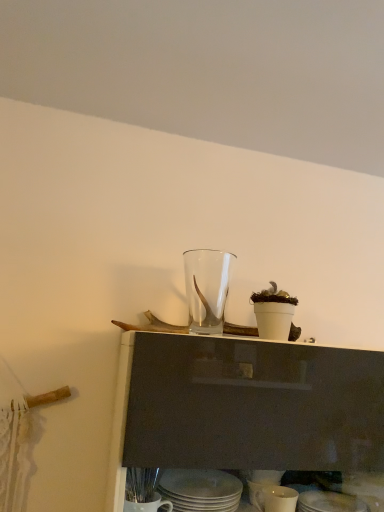
Describe the element at coordinates (200, 490) in the screenshot. I see `white ceramic plates at lower center, which appears as the second tableware when viewed from the top` at that location.

Measure the distance between point (x=189, y=483) and camera.

They are 3.41 feet apart.

I want to click on matte white plate at lower center, which ranks as the fourth tableware in top-to-bottom order, so tap(329, 502).

Which of these two, transparent glass vase at center, arranged as the 1th tableware when viewed from the top, or matte white plate at lower center, which ranks as the fourth tableware in top-to-bottom order, is thinner?

matte white plate at lower center, which ranks as the fourth tableware in top-to-bottom order, is thinner.

How distant is transparent glass vase at center, arranged as the 1th tableware when viewed from the top, from matte white plate at lower center, which appears as the first tableware when ordered from the bottom?

They are 22.08 inches apart.

Which of these two, transparent glass vase at center, which is the fourth tableware in bottom-to-top order, or matte white plate at lower center, which ranks as the fourth tableware in top-to-bottom order, is smaller?

matte white plate at lower center, which ranks as the fourth tableware in top-to-bottom order.

Is the depth of transparent glass vase at center, arranged as the 1th tableware when viewed from the top, less than that of matte white plate at lower center, which appears as the first tableware when ordered from the bottom?

No.

Is white ceramic plates at lower center, which appears as the second tableware when viewed from the top, in front of white glossy mug at lower center, arranged as the 3th tableware when viewed from the top?

Yes, it is in front of white glossy mug at lower center, arranged as the 3th tableware when viewed from the top.

Is white ceramic plates at lower center, arranged as the third tableware when ordered from the bottom, aimed at white glossy mug at lower center, acting as the 2th tableware starting from the bottom?

No, white ceramic plates at lower center, arranged as the third tableware when ordered from the bottom, is not oriented towards white glossy mug at lower center, acting as the 2th tableware starting from the bottom.

Which of these two, white ceramic plates at lower center, arranged as the third tableware when ordered from the bottom, or white glossy mug at lower center, arranged as the 3th tableware when viewed from the top, is bigger?

white ceramic plates at lower center, arranged as the third tableware when ordered from the bottom.

Is white glossy mug at lower center, arranged as the 3th tableware when viewed from the top, smaller than transparent glass vase at center, which is the fourth tableware in bottom-to-top order?

Yes, white glossy mug at lower center, arranged as the 3th tableware when viewed from the top, is smaller than transparent glass vase at center, which is the fourth tableware in bottom-to-top order.

Which is behind, point (270, 497) or point (187, 290)?

Positioned behind is point (187, 290).

From the image's perspective, which is below, white glossy mug at lower center, acting as the 2th tableware starting from the bottom, or transparent glass vase at center, which is the fourth tableware in bottom-to-top order?

white glossy mug at lower center, acting as the 2th tableware starting from the bottom, is shown below in the image.

Is the depth of white glossy mug at lower center, acting as the 2th tableware starting from the bottom, greater than that of transparent glass vase at center, which is the fourth tableware in bottom-to-top order?

No, it is not.

Is matte white plate at lower center, which appears as the first tableware when ordered from the bottom, facing towards white glossy mug at lower center, arranged as the 3th tableware when viewed from the top?

A: No, matte white plate at lower center, which appears as the first tableware when ordered from the bottom, is not aimed at white glossy mug at lower center, arranged as the 3th tableware when viewed from the top.

In the scene shown: Can you confirm if matte white plate at lower center, which ranks as the fourth tableware in top-to-bottom order, is positioned to the right of white glossy mug at lower center, acting as the 2th tableware starting from the bottom?

Correct, you'll find matte white plate at lower center, which ranks as the fourth tableware in top-to-bottom order, to the right of white glossy mug at lower center, acting as the 2th tableware starting from the bottom.

The width and height of the screenshot is (384, 512). I want to click on tableware below the white glossy mug at lower center, acting as the 2th tableware starting from the bottom (from the image's perspective), so click(x=329, y=502).

In the scene shown: Between matte white plate at lower center, which appears as the first tableware when ordered from the bottom, and white glossy mug at lower center, arranged as the 3th tableware when viewed from the top, which one has more height?

white glossy mug at lower center, arranged as the 3th tableware when viewed from the top.

Is point (287, 488) closer or farther from the camera than point (344, 504)?

Point (287, 488) is positioned closer to the camera compared to point (344, 504).

Can you confirm if white glossy mug at lower center, acting as the 2th tableware starting from the bottom, is thinner than matte white plate at lower center, which ranks as the fourth tableware in top-to-bottom order?

In fact, white glossy mug at lower center, acting as the 2th tableware starting from the bottom, might be wider than matte white plate at lower center, which ranks as the fourth tableware in top-to-bottom order.

Would you say matte white plate at lower center, which ranks as the fourth tableware in top-to-bottom order, is part of white glossy mug at lower center, acting as the 2th tableware starting from the bottom,'s contents?

No, matte white plate at lower center, which ranks as the fourth tableware in top-to-bottom order, is located outside of white glossy mug at lower center, acting as the 2th tableware starting from the bottom.

Could you tell me if white glossy mug at lower center, acting as the 2th tableware starting from the bottom, is facing matte white plate at lower center, which appears as the first tableware when ordered from the bottom?

No, white glossy mug at lower center, acting as the 2th tableware starting from the bottom, is not oriented towards matte white plate at lower center, which appears as the first tableware when ordered from the bottom.

From a real-world perspective, between white glossy mug at lower center, acting as the 2th tableware starting from the bottom, and white ceramic plates at lower center, arranged as the third tableware when ordered from the bottom, who is vertically lower?

From a 3D spatial view, white glossy mug at lower center, acting as the 2th tableware starting from the bottom, is below.

Is white glossy mug at lower center, acting as the 2th tableware starting from the bottom, to the left of white ceramic plates at lower center, which appears as the second tableware when viewed from the top, from the viewer's perspective?

No, white glossy mug at lower center, acting as the 2th tableware starting from the bottom, is not to the left of white ceramic plates at lower center, which appears as the second tableware when viewed from the top.

Based on the photo, is white glossy mug at lower center, acting as the 2th tableware starting from the bottom, positioned beyond the bounds of white ceramic plates at lower center, which appears as the second tableware when viewed from the top?

Yes, white glossy mug at lower center, acting as the 2th tableware starting from the bottom, is located beyond the bounds of white ceramic plates at lower center, which appears as the second tableware when viewed from the top.

Image resolution: width=384 pixels, height=512 pixels. I want to click on the 2nd tableware to the left when counting from the white glossy mug at lower center, arranged as the 3th tableware when viewed from the top, so click(200, 490).

Is transparent glass vase at center, arranged as the 1th tableware when viewed from the top, with white ceramic plates at lower center, arranged as the third tableware when ordered from the bottom?

No, transparent glass vase at center, arranged as the 1th tableware when viewed from the top, is not with white ceramic plates at lower center, arranged as the third tableware when ordered from the bottom.

Does transparent glass vase at center, which is the fourth tableware in bottom-to-top order, have a lesser width compared to white ceramic plates at lower center, arranged as the third tableware when ordered from the bottom?

Correct, the width of transparent glass vase at center, which is the fourth tableware in bottom-to-top order, is less than that of white ceramic plates at lower center, arranged as the third tableware when ordered from the bottom.

Which object is more forward, transparent glass vase at center, arranged as the 1th tableware when viewed from the top, or white ceramic plates at lower center, which appears as the second tableware when viewed from the top?

white ceramic plates at lower center, which appears as the second tableware when viewed from the top.

Which of these two, transparent glass vase at center, arranged as the 1th tableware when viewed from the top, or white ceramic plates at lower center, which appears as the second tableware when viewed from the top, stands shorter?

→ white ceramic plates at lower center, which appears as the second tableware when viewed from the top.

Find the location of a particular element. The width and height of the screenshot is (384, 512). tableware that is the 2nd one when counting backward from the matte white plate at lower center, which ranks as the fourth tableware in top-to-bottom order is located at coordinates (207, 288).

Which tableware is the 2nd one when counting from the front of the white glossy mug at lower center, arranged as the 3th tableware when viewed from the top? Please provide its 2D coordinates.

[(200, 490)]

Based on their spatial positions, is transparent glass vase at center, arranged as the 1th tableware when viewed from the top, or white glossy mug at lower center, acting as the 2th tableware starting from the bottom, closer to matte white plate at lower center, which ranks as the fourth tableware in top-to-bottom order?

The object closer to matte white plate at lower center, which ranks as the fourth tableware in top-to-bottom order, is white glossy mug at lower center, acting as the 2th tableware starting from the bottom.

Estimate the real-world distances between objects in this image. Which object is further from transparent glass vase at center, which is the fourth tableware in bottom-to-top order, white glossy mug at lower center, acting as the 2th tableware starting from the bottom, or matte white plate at lower center, which appears as the first tableware when ordered from the bottom?

matte white plate at lower center, which appears as the first tableware when ordered from the bottom, is further to transparent glass vase at center, which is the fourth tableware in bottom-to-top order.

Based on their spatial positions, is transparent glass vase at center, which is the fourth tableware in bottom-to-top order, or white glossy mug at lower center, acting as the 2th tableware starting from the bottom, further from white ceramic plates at lower center, which appears as the second tableware when viewed from the top?

transparent glass vase at center, which is the fourth tableware in bottom-to-top order.

Estimate the real-world distances between objects in this image. Which object is further from white glossy mug at lower center, arranged as the 3th tableware when viewed from the top, transparent glass vase at center, which is the fourth tableware in bottom-to-top order, or white ceramic plates at lower center, which appears as the second tableware when viewed from the top?

The object further to white glossy mug at lower center, arranged as the 3th tableware when viewed from the top, is transparent glass vase at center, which is the fourth tableware in bottom-to-top order.

Which object lies further to the anchor point transparent glass vase at center, arranged as the 1th tableware when viewed from the top, white ceramic plates at lower center, which appears as the second tableware when viewed from the top, or white glossy mug at lower center, acting as the 2th tableware starting from the bottom?

Among the two, white glossy mug at lower center, acting as the 2th tableware starting from the bottom, is located further to transparent glass vase at center, arranged as the 1th tableware when viewed from the top.

When comparing their distances from white glossy mug at lower center, acting as the 2th tableware starting from the bottom, does white ceramic plates at lower center, which appears as the second tableware when viewed from the top, or matte white plate at lower center, which ranks as the fourth tableware in top-to-bottom order, seem further?

white ceramic plates at lower center, which appears as the second tableware when viewed from the top, is positioned further to the anchor white glossy mug at lower center, acting as the 2th tableware starting from the bottom.

Considering their positions, is white glossy mug at lower center, arranged as the 3th tableware when viewed from the top, positioned closer to white ceramic plates at lower center, which appears as the second tableware when viewed from the top, than matte white plate at lower center, which ranks as the fourth tableware in top-to-bottom order?

Among the two, white glossy mug at lower center, arranged as the 3th tableware when viewed from the top, is located nearer to white ceramic plates at lower center, which appears as the second tableware when viewed from the top.

Considering their positions, is white ceramic plates at lower center, which appears as the second tableware when viewed from the top, positioned closer to matte white plate at lower center, which appears as the first tableware when ordered from the bottom, than white glossy mug at lower center, acting as the 2th tableware starting from the bottom?

white glossy mug at lower center, acting as the 2th tableware starting from the bottom, is closer to matte white plate at lower center, which appears as the first tableware when ordered from the bottom.

Find the location of a particular element. The width and height of the screenshot is (384, 512). tableware that lies between transparent glass vase at center, which is the fourth tableware in bottom-to-top order, and white glossy mug at lower center, arranged as the 3th tableware when viewed from the top, from top to bottom is located at coordinates (200, 490).